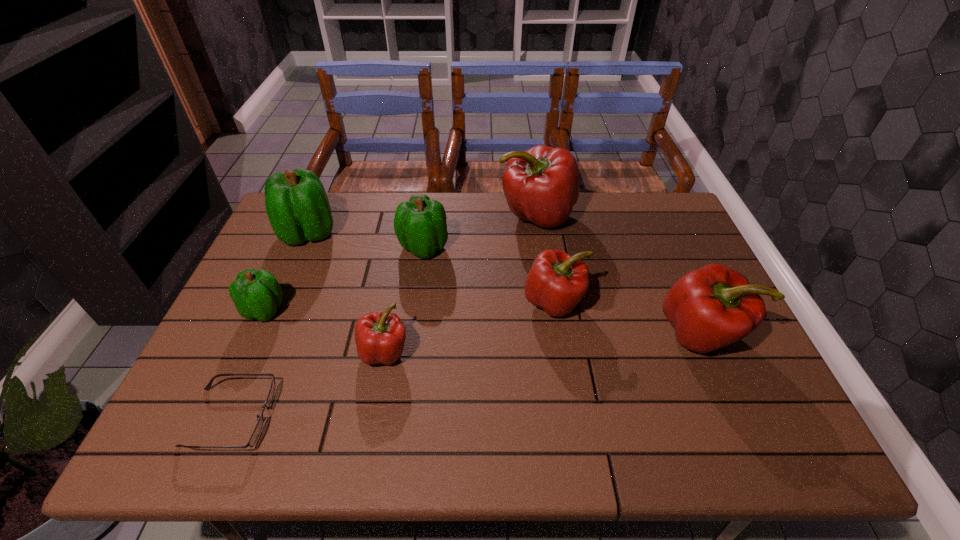
The height and width of the screenshot is (540, 960). Find the location of `free space located 0.170m on the right of the farthest pink bell pepper`. free space located 0.170m on the right of the farthest pink bell pepper is located at coordinates (626, 215).

Identify the location of vacant space located 0.180m on the front of the biggest green bell pepper. The width and height of the screenshot is (960, 540). (280, 298).

Find the location of `vacant position located on the left of the rightmost bell pepper`. vacant position located on the left of the rightmost bell pepper is located at coordinates click(x=576, y=334).

The width and height of the screenshot is (960, 540). I want to click on free space located 0.250m on the right of the second biggest green bell pepper, so click(x=530, y=247).

This screenshot has width=960, height=540. Identify the location of vacant position located on the right of the third biggest pink bell pepper. pos(634,302).

Identify the location of vacant space located 0.170m on the front of the nearest green bell pepper. The height and width of the screenshot is (540, 960). (232, 383).

At what (x,y) coordinates should I click in order to perform the action: click on vacant space situated on the right of the smallest pink bell pepper. Please return your answer as a coordinate pair (x, y). Looking at the image, I should click on (487, 352).

The width and height of the screenshot is (960, 540). In order to click on free space located 0.110m on the front-facing side of the shortest object in this screenshot , I will do `click(321, 417)`.

Locate an element on the screen. The image size is (960, 540). object present at the near edge is located at coordinates (253, 438).

You are a GUI agent. You are given a task and a screenshot of the screen. Output one action in this format:
    pyautogui.click(x=<x>, y=<y>)
    Task: Click on the spectacles situated at the left edge
    The height and width of the screenshot is (540, 960).
    Given the screenshot: What is the action you would take?
    pyautogui.click(x=253, y=438)